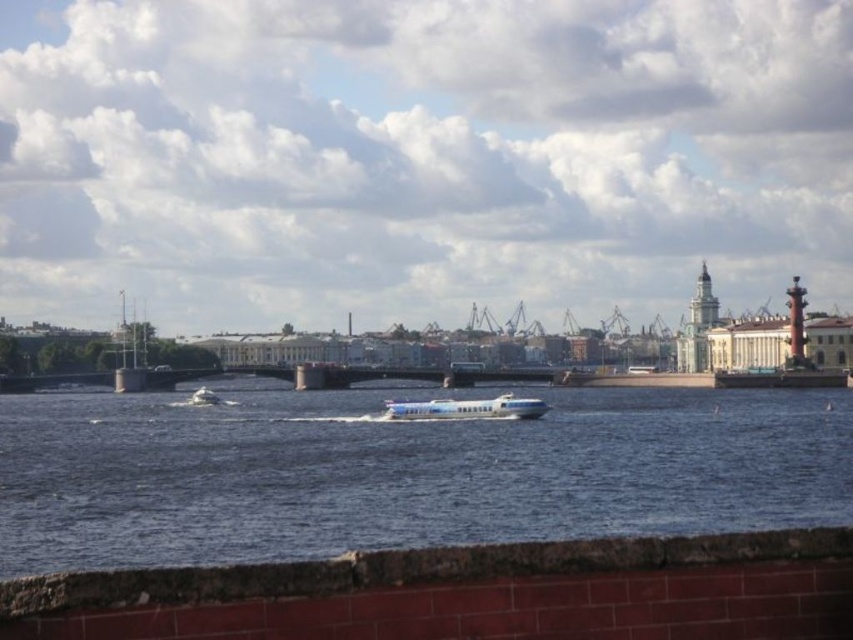
Is blue water at center shorter than white glossy boat at center?

No.

From the picture: Who is shorter, blue water at center or white glossy boat at center?

white glossy boat at center

Who is more forward, (15, 422) or (494, 417)?

Positioned in front is point (494, 417).

Image resolution: width=853 pixels, height=640 pixels. I want to click on blue water at center, so click(x=402, y=472).